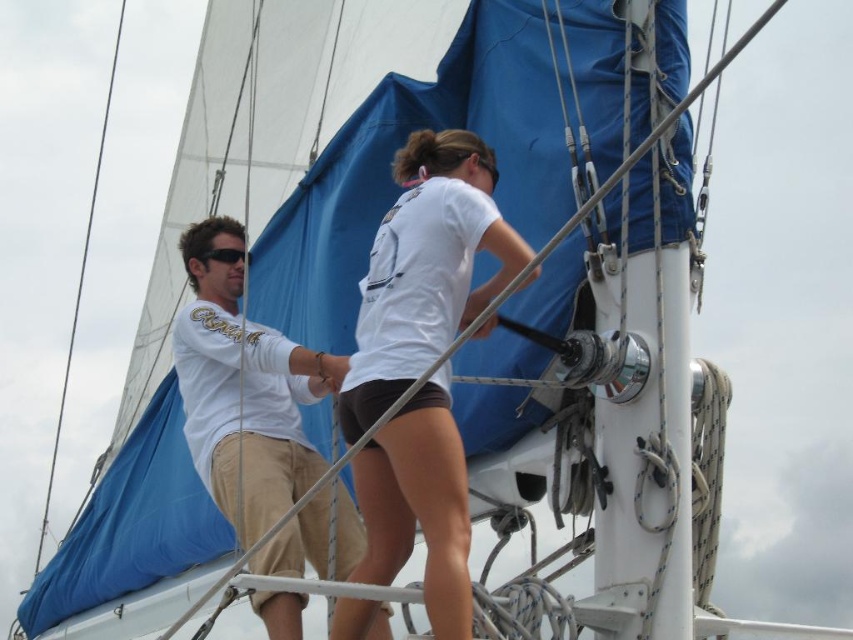
You are standing on the deck of the sailboat and see the point at coordinates (x=425, y=269). What object is located at that point?

The point at coordinates (x=425, y=269) indicates white matte shorts at center.

You are a photographer on a nearby boat and want to take a photo of the two people. You notice the white cotton shirt at center and the black plastic sunglasses at left. Which object should you focus on first if you want to capture both in the same frame without moving the camera?

The white cotton shirt at center is located below the black plastic sunglasses at left, so focusing on the black plastic sunglasses at left first will ensure both are in the frame since it is higher up.

You are on a sailboat and need to secure two points on the boat. The first point is at coordinates point (381, 278) and the second is at point (218, 500). Which point is closer to you?

Point (381, 278) is closer to the viewer than point (218, 500).